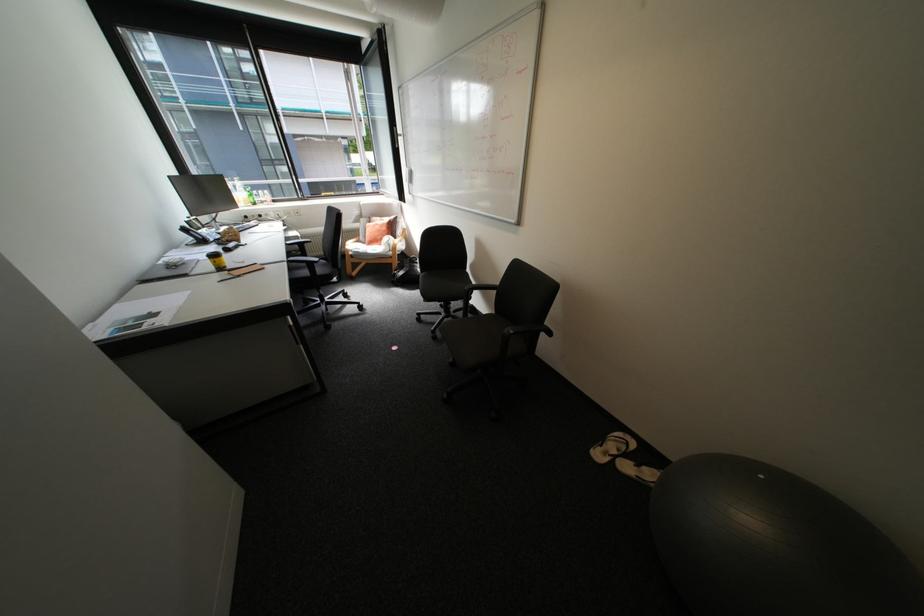
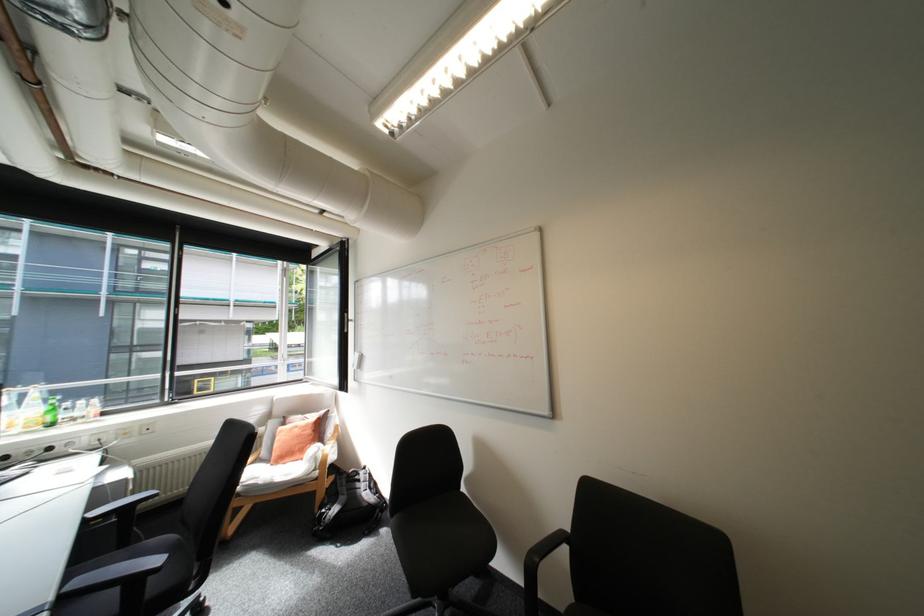
Where in the second image is the point corresponding to pixel 256 204 from the first image?

(38, 427)